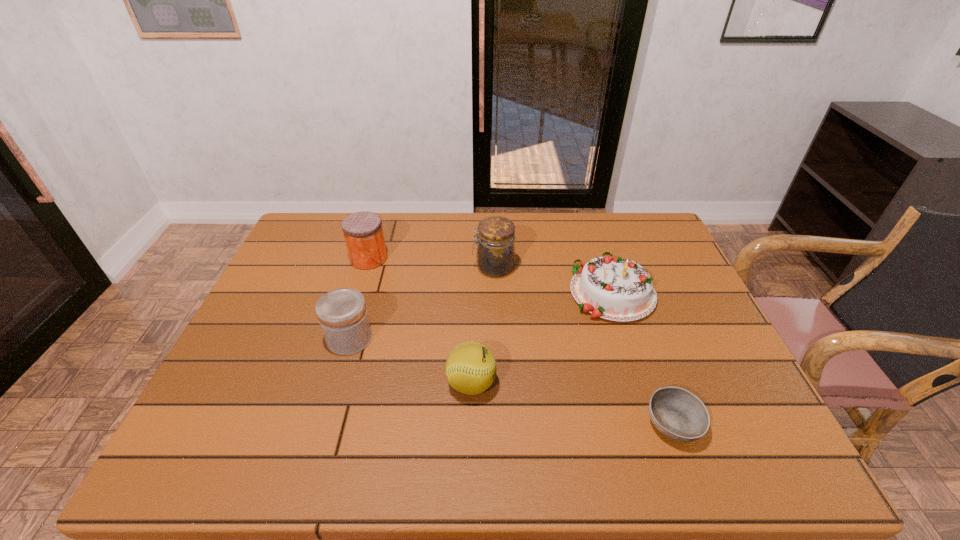
This screenshot has width=960, height=540. What are the coordinates of `the rightmost jar` in the screenshot? It's located at (495, 255).

Locate an element on the screen. cake is located at coordinates (614, 289).

This screenshot has width=960, height=540. In order to click on the nearest jar in this screenshot , I will do `click(342, 313)`.

This screenshot has width=960, height=540. I want to click on softball, so click(x=470, y=367).

You are a GUI agent. You are given a task and a screenshot of the screen. Output one action in this format:
    pyautogui.click(x=<x>, y=<y>)
    Task: Click on the bowl
    
    Given the screenshot: What is the action you would take?
    pyautogui.click(x=676, y=413)

At what (x,y) coordinates should I click in order to perform the action: click on free space located on the lid of the rightmost jar. Please return your answer as a coordinate pair (x, y). Looking at the image, I should click on (397, 267).

This screenshot has height=540, width=960. Identify the location of vacant position located 0.120m on the lid of the rightmost jar. (433, 267).

What are the coordinates of `vacant space positioned on the lid of the rightmost jar` in the screenshot? It's located at (410, 267).

At what (x,y) coordinates should I click in order to perform the action: click on vacant space located 0.250m on the front of the cake. Please return your answer as a coordinate pair (x, y). This screenshot has width=960, height=540. Looking at the image, I should click on (650, 407).

Locate an element on the screen. Image resolution: width=960 pixels, height=540 pixels. free space located on the right of the nearest jar is located at coordinates (469, 338).